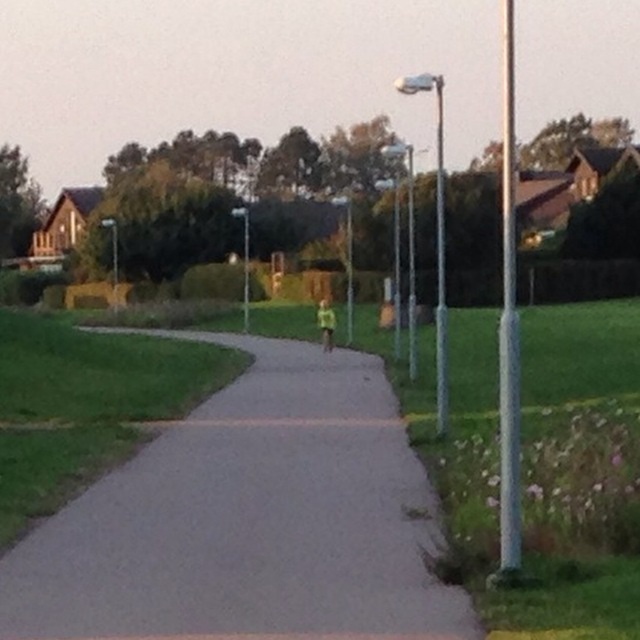
Question: Is silver metallic pole at right thinner than metallic pole at upper right?

Choices:
 (A) no
 (B) yes

Answer: (A)

Question: Is silver metallic pole at right thinner than metallic pole at center?

Choices:
 (A) no
 (B) yes

Answer: (A)

Question: Which object appears farthest from the camera in this image?

Choices:
 (A) gray asphalt path at center
 (B) metallic pole at upper right

Answer: (B)

Question: Can you confirm if silver metallic pole at right is positioned below metallic pole at upper right?

Choices:
 (A) yes
 (B) no

Answer: (B)

Question: Which object appears closest to the camera in this image?

Choices:
 (A) gray asphalt path at center
 (B) silver metallic pole at right
 (C) metallic pole at upper right

Answer: (A)

Question: Which point appears farthest from the camera in this image?

Choices:
 (A) click(x=435, y=376)
 (B) click(x=339, y=449)

Answer: (A)